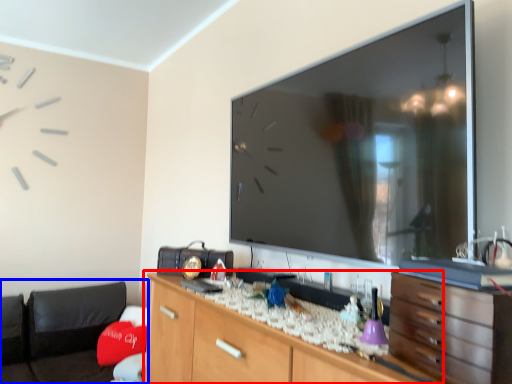
Question: Which point is closer to the camera, cabinetry (highlighted by a red box) or bean bag chair (highlighted by a blue box)?

Choices:
 (A) cabinetry
 (B) bean bag chair

Answer: (A)